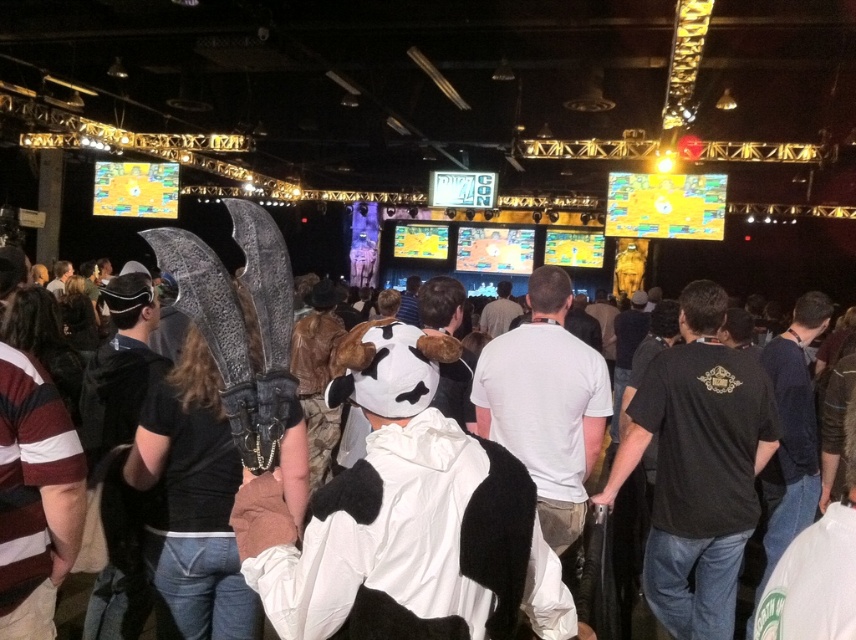
You are organizing a small booth at the gaming convention and need to place both the white plush cow at center and the white fur coat at center on a narrow shelf. Which item should you place first to ensure both fit on the shelf?

The white plush cow at center should be placed first because it occupies less space than the white fur coat at center, allowing both items to fit on the narrow shelf.

You are organizing a photo shoot for a fashion brand and want to place the white plush cow at center and the white fur coat at center on a table. The table has limited width. Based on the scene description, which object would you choose to place on the table first to ensure both fit?

The white plush cow at center is thinner than the white fur coat at center, so you should place the white fur coat at center first to accommodate its width before placing the thinner white plush cow at center.

You are standing at the back of the convention hall and want to pick up the white plush cow at center and the white fur coat at center. Which item can you reach first if you walk straight towards the stage?

The white plush cow at center is closer to the viewer than the white fur coat at center, so you can reach the white plush cow at center first by walking straight towards the stage.